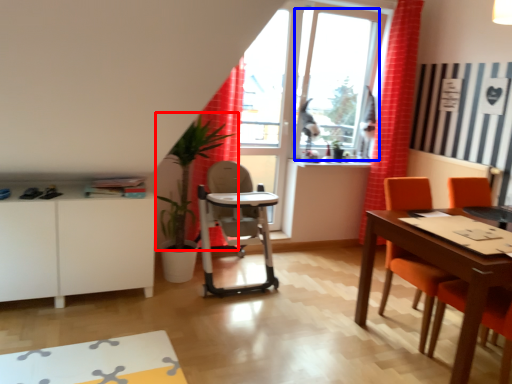
Question: Which point is closer to the camera, plant (highlighted by a red box) or window screen (highlighted by a blue box)?

Choices:
 (A) plant
 (B) window screen

Answer: (A)